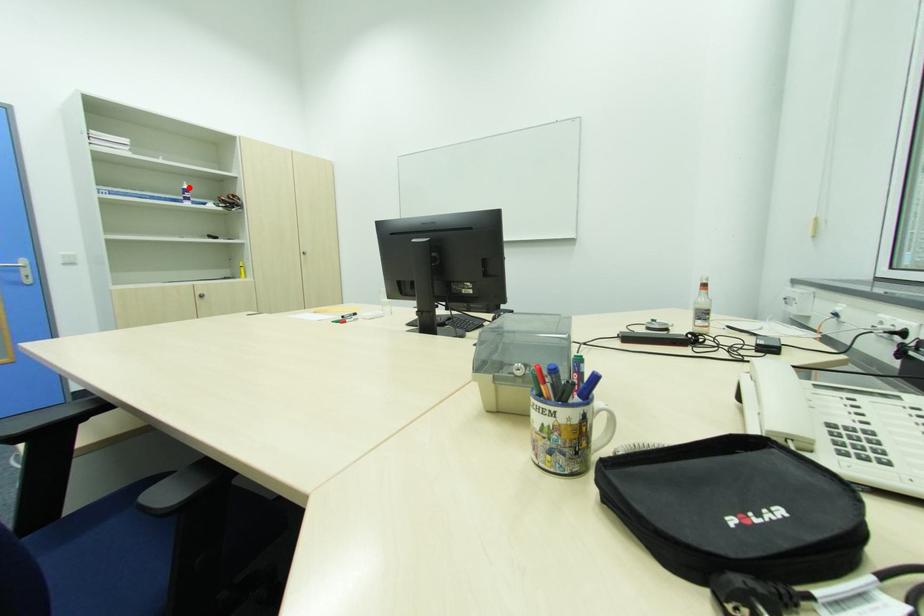
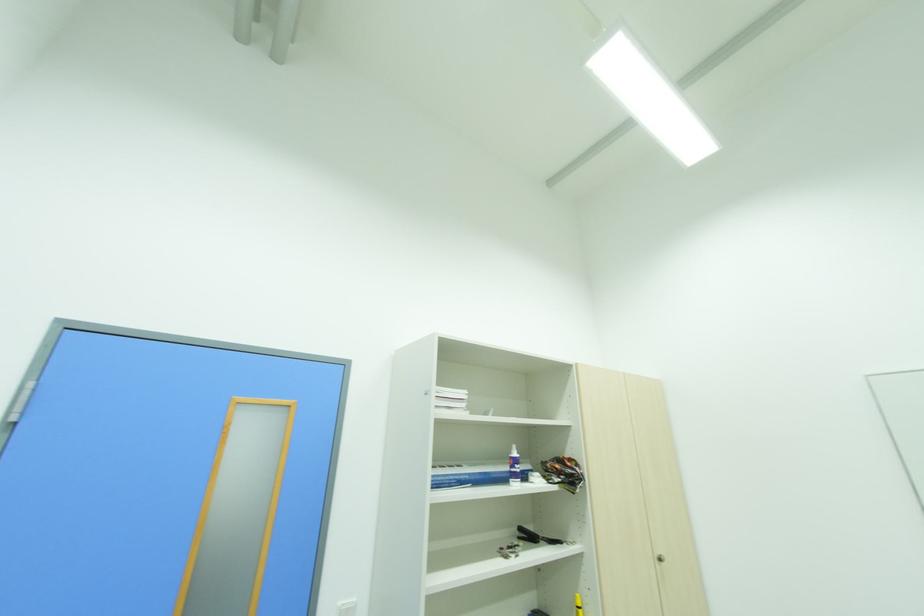
Find the pixel in the second image that matches the highlighted location in the first image.

(517, 455)